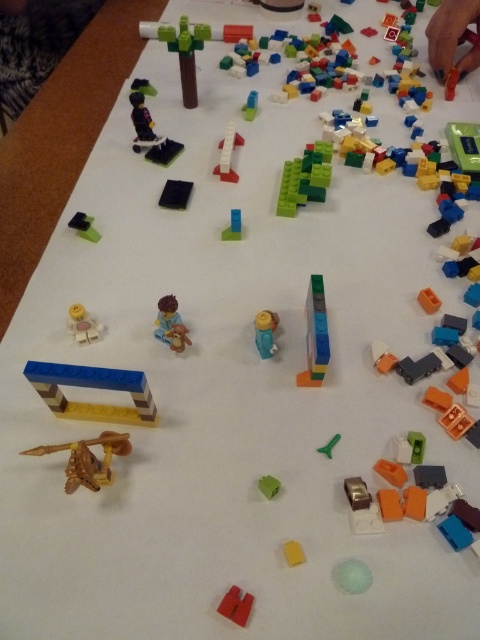
You are a child who wants to reach the blue matte arch at center on the table. If your hand is 12 inches long, can you touch it without moving your arm?

The blue matte arch at center is 24.52 inches away from the viewer. Since your hand is only 12 inches long, you cannot reach it without moving your arm.

Based on the scene description, where is the blue matte arch at center located on the image grid?

The blue matte arch at center is located at point coordinates of [94,387].